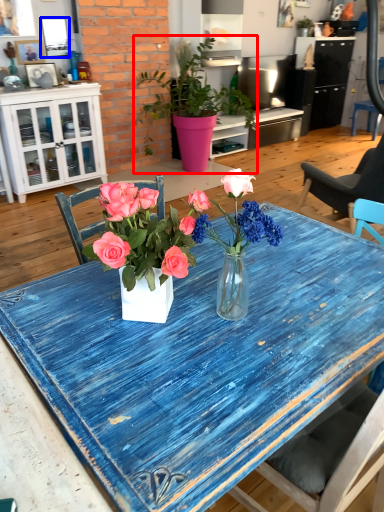
Question: Which object appears farthest to the camera in this image, houseplant (highlighted by a red box) or picture frame (highlighted by a blue box)?

Choices:
 (A) houseplant
 (B) picture frame

Answer: (B)